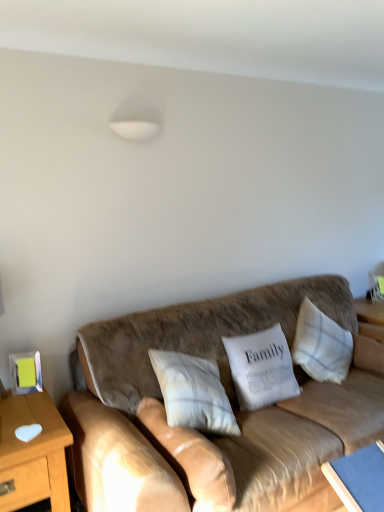
Question: From a real-world perspective, is wooden table at left, the first table when ordered from left to right, physically located above or below white textured pillow at center, which is the 4th pillow in right-to-left order?

Choices:
 (A) above
 (B) below

Answer: (B)

Question: In the image, is wooden table at left, the 2th table when ordered from right to left, on the left side or the right side of white textured pillow at center, which is the 4th pillow in right-to-left order?

Choices:
 (A) left
 (B) right

Answer: (A)

Question: Estimate the real-world distances between objects in this image. Which object is closer to the brown leather couch at center?

Choices:
 (A) white textured pillow at center, arranged as the 1th pillow when viewed from the left
 (B) white cotton pillow at center, which is counted as the 3th pillow, starting from the right
 (C) blue fabric table at lower right, the second table from the left
 (D) wooden table at left, the 2th table when ordered from right to left
 (E) white fabric pillow at center, which ranks as the 2th pillow in right-to-left order

Answer: (B)

Question: Estimate the real-world distances between objects in this image. Which object is farther from the white cotton pillow at center, which is counted as the 3th pillow, starting from the right?

Choices:
 (A) brown leather couch at center
 (B) white textured pillow at right, which is the 1th pillow in right-to-left order
 (C) blue fabric table at lower right, the first table viewed from the right
 (D) wooden table at left, the first table when ordered from left to right
 (E) white textured pillow at center, which is the 4th pillow in right-to-left order

Answer: (B)